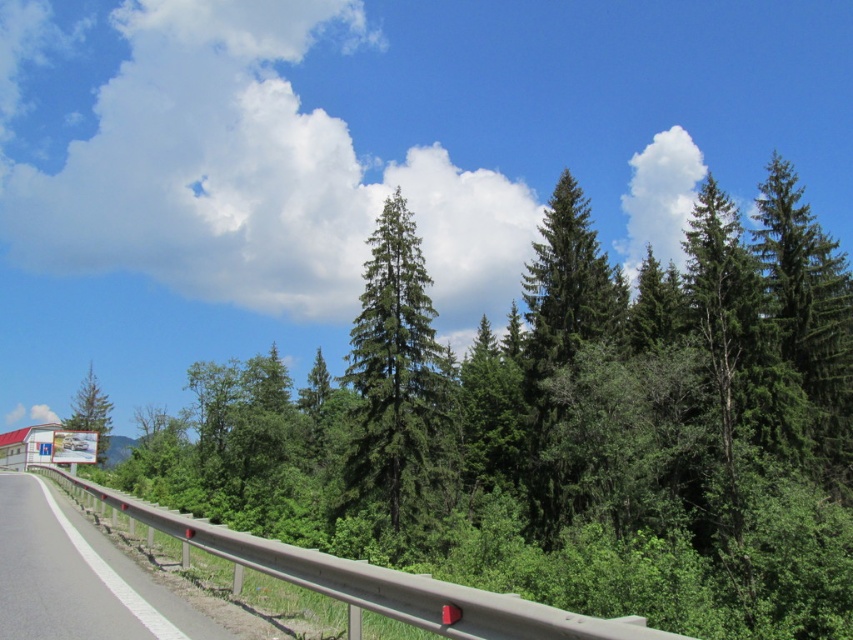
Which is behind, point (447, 461) or point (90, 378)?

The point (90, 378) is behind.

Is point (378, 344) in front of point (91, 408)?

Yes, point (378, 344) is in front of point (91, 408).

Who is more forward, (x=403, y=196) or (x=68, y=420)?

Point (x=403, y=196)

Find the location of `green matte tree at center`. green matte tree at center is located at coordinates (399, 385).

Can you confirm if metallic gray guardrail at lower left is thinner than green matte tree at upper center?

Correct, metallic gray guardrail at lower left's width is less than green matte tree at upper center's.

Does metallic gray guardrail at lower left come behind green matte tree at upper center?

That is False.

The height and width of the screenshot is (640, 853). Describe the element at coordinates (76, 577) in the screenshot. I see `metallic gray guardrail at lower left` at that location.

You are a GUI agent. You are given a task and a screenshot of the screen. Output one action in this format:
    pyautogui.click(x=<x>, y=<y>)
    Task: Click on the metallic gray guardrail at lower left
    The width and height of the screenshot is (853, 640).
    Given the screenshot: What is the action you would take?
    pyautogui.click(x=76, y=577)

Which is more to the right, green matte tree at center or metallic gray guardrail at lower left?

From the viewer's perspective, green matte tree at center appears more on the right side.

Which is below, green matte tree at center or metallic gray guardrail at lower left?

metallic gray guardrail at lower left is lower down.

This screenshot has width=853, height=640. In order to click on green matte tree at center in this screenshot , I will do `click(399, 385)`.